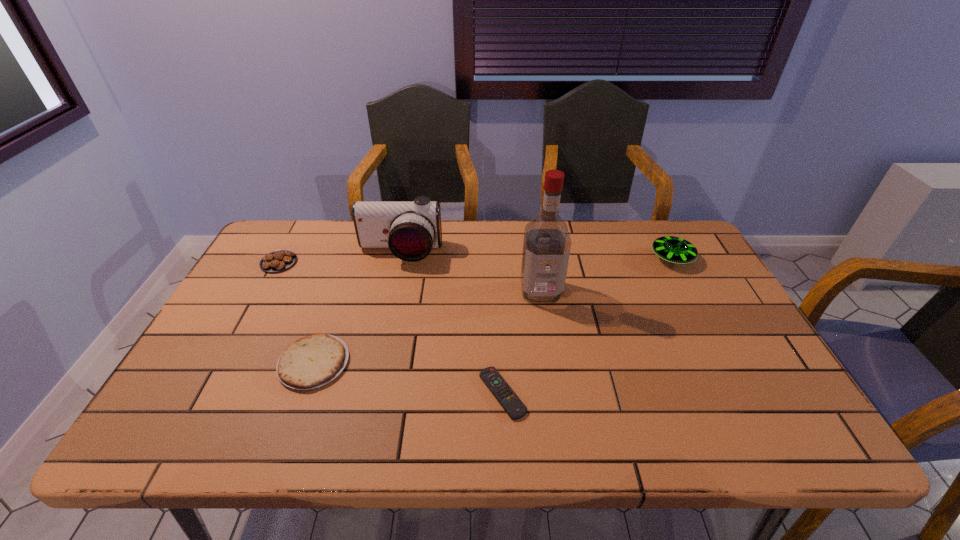
Where is `object that is at the right edge`? object that is at the right edge is located at coordinates (672, 249).

You are a GUI agent. You are given a task and a screenshot of the screen. Output one action in this format:
    pyautogui.click(x=<x>, y=<y>)
    Task: Click on the object positioned at the far left corner
    Image resolution: width=960 pixels, height=540 pixels.
    Given the screenshot: What is the action you would take?
    pyautogui.click(x=279, y=260)

Find the location of a particular element. object at the far right corner is located at coordinates (672, 249).

At what (x,y) coordinates should I click in order to perform the action: click on free space at the far edge. Please return your answer as a coordinate pair (x, y). The height and width of the screenshot is (540, 960). Looking at the image, I should click on (512, 231).

In the image, there is a desktop. Identify the location of vacant space at the left edge. Image resolution: width=960 pixels, height=540 pixels. (211, 403).

The height and width of the screenshot is (540, 960). Identify the location of vacant space at the right edge of the desktop. (701, 362).

Where is `empty location between the rightmost object and the liquor`? The width and height of the screenshot is (960, 540). empty location between the rightmost object and the liquor is located at coordinates (607, 275).

Find the location of a particular element. Image resolution: width=960 pixels, height=540 pixels. vacant area that lies between the camcorder and the leftmost object is located at coordinates (339, 257).

Where is `vacant space in between the tallest object and the rightmost object`? vacant space in between the tallest object and the rightmost object is located at coordinates pyautogui.click(x=607, y=275).

This screenshot has width=960, height=540. I want to click on vacant point located between the tortilla and the shortest object, so point(408,378).